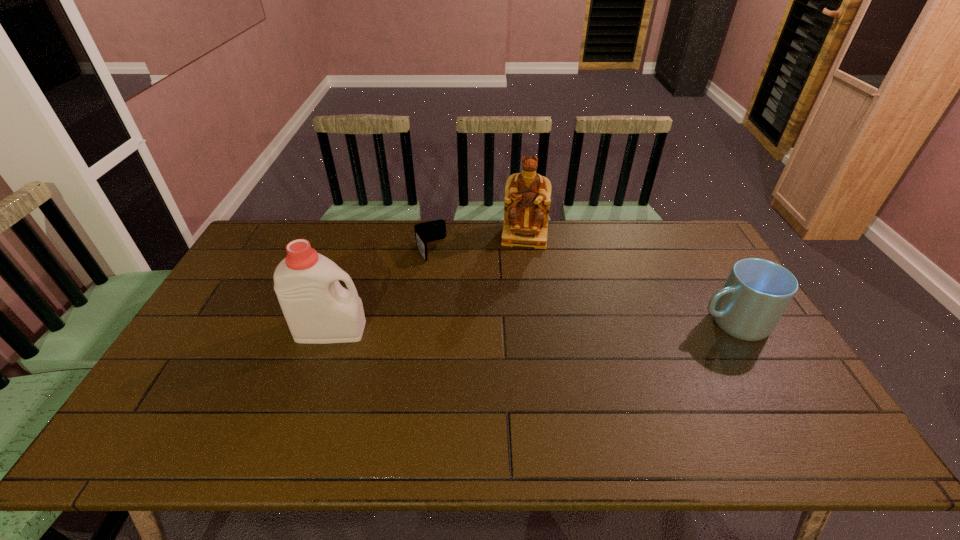
Find the location of `unoccupied area between the rightmost object and the figurine`. unoccupied area between the rightmost object and the figurine is located at coordinates (628, 279).

Locate an element on the screen. The width and height of the screenshot is (960, 540). free space between the leftmost object and the second shortest object is located at coordinates (531, 327).

The height and width of the screenshot is (540, 960). What are the coordinates of `object that stands as the closest to the leftmost object` in the screenshot? It's located at (429, 231).

Locate an element on the screen. The width and height of the screenshot is (960, 540). the closest object to the second shortest object is located at coordinates (527, 200).

What are the coordinates of `vacant area in the image that satisfies the following two spatial constraints: 1. on the back side of the third object from right to left; 2. on the left side of the second object from right to left` in the screenshot? It's located at (433, 236).

Identify the location of vacant space that satisfies the following two spatial constraints: 1. on the front side of the shortest object; 2. on the left side of the rightmost object. (420, 322).

This screenshot has height=540, width=960. In order to click on vacant area that satisfies the following two spatial constraints: 1. on the back side of the third object from left to right; 2. on the left side of the shortest object in this screenshot , I will do `click(433, 236)`.